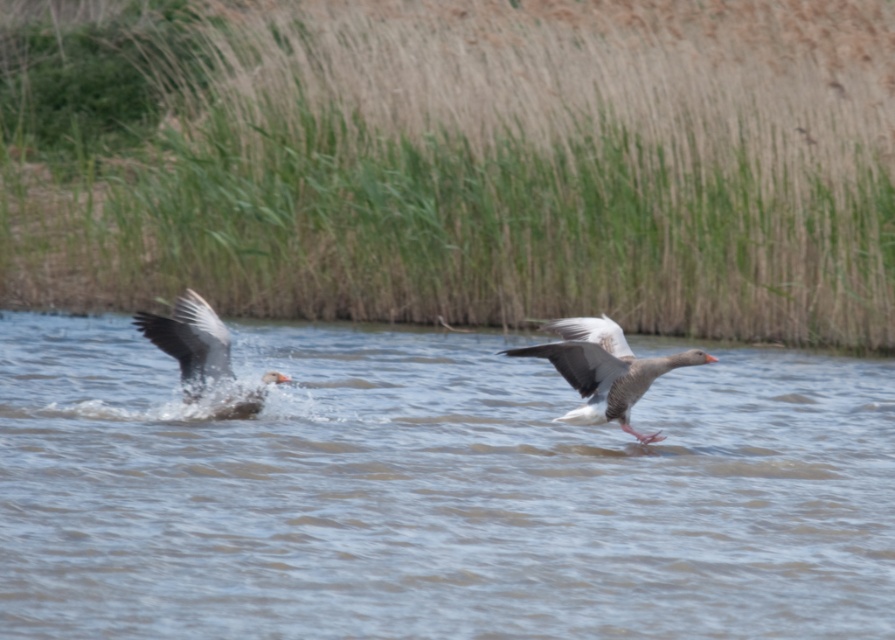
Question: Which point appears farthest from the camera in this image?

Choices:
 (A) (273, 339)
 (B) (831, 22)

Answer: (B)

Question: Is green grass reed at upper center further to the viewer compared to gray matte duck at left?

Choices:
 (A) yes
 (B) no

Answer: (A)

Question: Is gray matte duck at center behind gray matte duck at left?

Choices:
 (A) no
 (B) yes

Answer: (A)

Question: Which of the following is the farthest from the observer?

Choices:
 (A) (166, 352)
 (B) (582, 420)

Answer: (A)

Question: Which of the following is the farthest from the observer?

Choices:
 (A) gray matte duck at center
 (B) gray matte duck at left
 (C) green grass reed at upper center

Answer: (C)

Question: Is green grass reed at upper center bigger than gray matte duck at left?

Choices:
 (A) no
 (B) yes

Answer: (B)